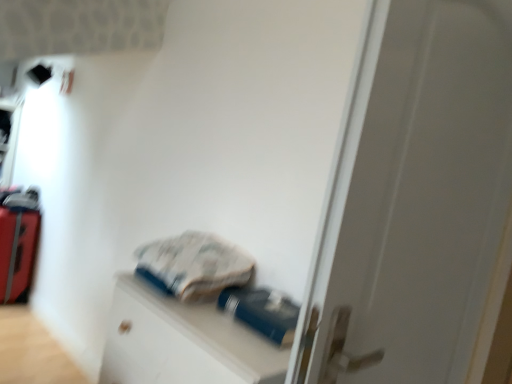
Identify the location of blue rubberized bottle at center. (262, 312).

Measure the distance between red suitcase at left and camera.

They are 3.06 meters apart.

Image resolution: width=512 pixels, height=384 pixels. I want to click on blue rubberized bottle at center, so click(262, 312).

What's the angular difference between white matte door at center and blue rubberized bottle at center's facing directions?

The facing directions of white matte door at center and blue rubberized bottle at center are 79.9 degrees apart.

From a real-world perspective, is white matte door at center positioned above or below blue rubberized bottle at center?

Clearly, from a real-world perspective, white matte door at center is above blue rubberized bottle at center.

From the picture: In the image, is white matte door at center on the left side or the right side of blue rubberized bottle at center?

Based on their positions, white matte door at center is located to the right of blue rubberized bottle at center.

Does white matte door at center come in front of blue rubberized bottle at center?

Yes, white matte door at center is closer to the camera.

Which point is more forward, [279,304] or [420,253]?

The point [420,253] is closer to the camera.

Can you confirm if blue rubberized bottle at center is taller than white matte door at center?

In fact, blue rubberized bottle at center may be shorter than white matte door at center.

Are blue rubberized bottle at center and white matte door at center located far from each other?

No.

Considering the relative sizes of blue matte file cabinet at center and blue rubberized bottle at center in the image provided, is blue matte file cabinet at center taller than blue rubberized bottle at center?

Yes, blue matte file cabinet at center is taller than blue rubberized bottle at center.

Is blue matte file cabinet at center next to blue rubberized bottle at center and touching it?

Result: They are not placed beside each other.

Can we say blue matte file cabinet at center lies outside blue rubberized bottle at center?

blue matte file cabinet at center lies outside blue rubberized bottle at center's area.

Which is correct: white matte door at center is inside red suitcase at left, or outside of it?

white matte door at center cannot be found inside red suitcase at left.

From a real-world perspective, is white matte door at center on top of red suitcase at left?

Yes, from a real-world perspective, white matte door at center is over red suitcase at left

Is the position of white matte door at center more distant than that of red suitcase at left?

No, white matte door at center is closer to the viewer.

Does white matte door at center have a lesser width compared to red suitcase at left?

Correct, the width of white matte door at center is less than that of red suitcase at left.

From their relative heights in the image, would you say red suitcase at left is taller or shorter than blue rubberized bottle at center?

red suitcase at left is taller than blue rubberized bottle at center.

Is red suitcase at left inside the boundaries of blue rubberized bottle at center, or outside?

red suitcase at left lies outside blue rubberized bottle at center.

Find the location of a particular element. equipment above the red suitcase at left (from a real-world perspective) is located at coordinates (262, 312).

Consider the image. Is red suitcase at left facing towards blue rubberized bottle at center?

No, red suitcase at left does not turn towards blue rubberized bottle at center.

Consider the image. Is blue matte file cabinet at center facing away from white matte door at center?

No, blue matte file cabinet at center's orientation is not away from white matte door at center.

From the picture: From a real-world perspective, which is physically above, blue matte file cabinet at center or white matte door at center?

white matte door at center, from a real-world perspective.

Is blue matte file cabinet at center inside or outside of white matte door at center?

Result: blue matte file cabinet at center is located beyond the bounds of white matte door at center.

Relative to blue matte file cabinet at center, is blue rubberized bottle at center in front or behind?

Clearly, blue rubberized bottle at center is behind blue matte file cabinet at center.

From a real-world perspective, is blue rubberized bottle at center located higher than blue matte file cabinet at center?

Yes, from a real-world perspective, blue rubberized bottle at center is above blue matte file cabinet at center.

From the image's perspective, which is below, blue rubberized bottle at center or blue matte file cabinet at center?

From the image's view, blue matte file cabinet at center is below.

Where is `door lying on the right of blue rubberized bottle at center`? The height and width of the screenshot is (384, 512). door lying on the right of blue rubberized bottle at center is located at coordinates coord(414,198).

Find the location of a particular element. This screenshot has width=512, height=384. equipment that appears below the white matte door at center (from a real-world perspective) is located at coordinates (262, 312).

When comparing their distances from white matte door at center, does blue rubberized bottle at center or blue matte file cabinet at center seem further?

The object further to white matte door at center is blue matte file cabinet at center.

Based on their spatial positions, is blue matte file cabinet at center or red suitcase at left further from blue rubberized bottle at center?

The object further to blue rubberized bottle at center is red suitcase at left.

Which object lies nearer to the anchor point blue matte file cabinet at center, white matte door at center or red suitcase at left?

The object closer to blue matte file cabinet at center is white matte door at center.

Looking at the image, which one is located closer to red suitcase at left, blue matte file cabinet at center or white matte door at center?

Based on the image, blue matte file cabinet at center appears to be nearer to red suitcase at left.

Based on their spatial positions, is blue matte file cabinet at center or red suitcase at left further from white matte door at center?

red suitcase at left.

Based on their spatial positions, is blue rubberized bottle at center or red suitcase at left further from white matte door at center?

Among the two, red suitcase at left is located further to white matte door at center.

Looking at the image, which one is located closer to red suitcase at left, white matte door at center or blue matte file cabinet at center?

blue matte file cabinet at center is positioned closer to the anchor red suitcase at left.

Based on their spatial positions, is white matte door at center or blue matte file cabinet at center closer to blue rubberized bottle at center?

Among the two, blue matte file cabinet at center is located nearer to blue rubberized bottle at center.

Locate an element on the screen. Image resolution: width=512 pixels, height=384 pixels. equipment between red suitcase at left and white matte door at center from left to right is located at coordinates (262, 312).

Find the location of a particular element. file cabinet between red suitcase at left and blue rubberized bottle at center is located at coordinates (182, 342).

The height and width of the screenshot is (384, 512). I want to click on file cabinet located between red suitcase at left and white matte door at center in the left-right direction, so click(182, 342).

Where is `equipment between white matte door at center and blue matte file cabinet at center in the up-down direction`? The width and height of the screenshot is (512, 384). equipment between white matte door at center and blue matte file cabinet at center in the up-down direction is located at coordinates (262, 312).